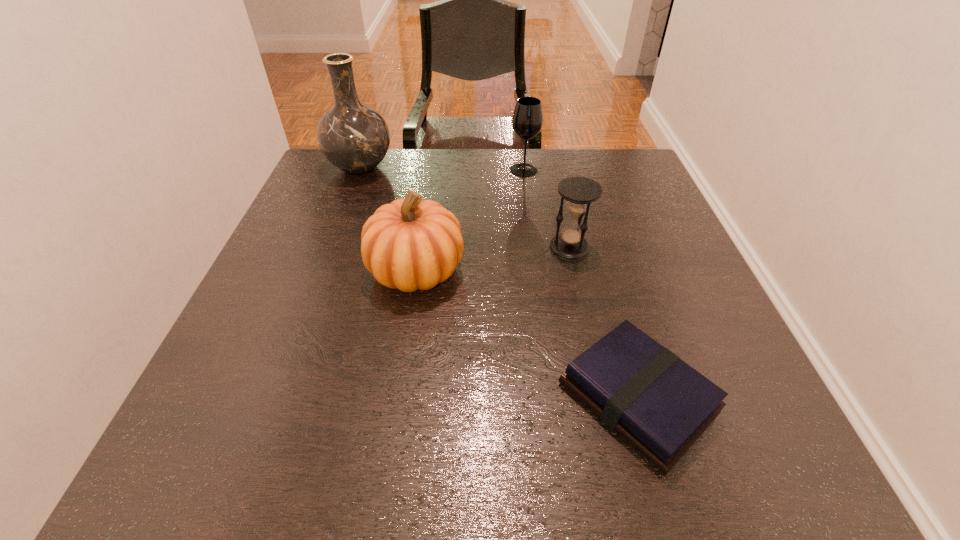
Where is `vacant area situated 0.080m on the front of the hourglass`? Image resolution: width=960 pixels, height=540 pixels. vacant area situated 0.080m on the front of the hourglass is located at coordinates (579, 287).

What are the coordinates of `vacant area located 0.170m on the left of the shortest object` in the screenshot? It's located at (455, 398).

Where is `vase that is at the far edge`? vase that is at the far edge is located at coordinates (355, 138).

Identify the location of wineglass that is at the far edge. The height and width of the screenshot is (540, 960). (527, 120).

Find the location of `object present at the near edge`. object present at the near edge is located at coordinates (658, 404).

Find the location of a particular element. The image size is (960, 540). object present at the left edge is located at coordinates (355, 138).

Where is `object present at the right edge`? object present at the right edge is located at coordinates (658, 404).

Find the location of a particular element. The width and height of the screenshot is (960, 540). object that is positioned at the far left corner is located at coordinates (x=355, y=138).

Locate an element on the screen. Image resolution: width=960 pixels, height=540 pixels. object that is at the near right corner is located at coordinates (658, 404).

Where is `blank space at the far edge of the desktop`? Image resolution: width=960 pixels, height=540 pixels. blank space at the far edge of the desktop is located at coordinates (465, 163).